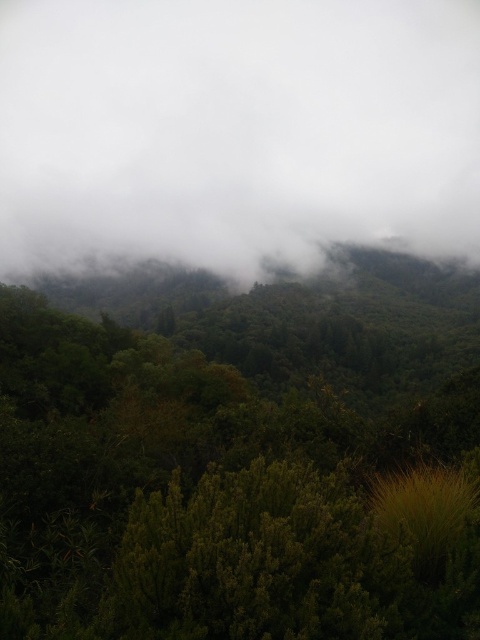
Question: Can you confirm if green leafy tree at center is bigger than white fluffy cloud at upper center?

Choices:
 (A) yes
 (B) no

Answer: (B)

Question: Can you confirm if green leafy tree at center is positioned to the left of white fluffy cloud at upper center?

Choices:
 (A) yes
 (B) no

Answer: (B)

Question: Does green leafy tree at center have a lesser width compared to white fluffy cloud at upper center?

Choices:
 (A) no
 (B) yes

Answer: (B)

Question: Which point is farther to the camera?

Choices:
 (A) white fluffy cloud at upper center
 (B) green leafy tree at center

Answer: (A)

Question: Which point is farther to the camera?

Choices:
 (A) green leafy tree at center
 (B) white fluffy cloud at upper center

Answer: (B)